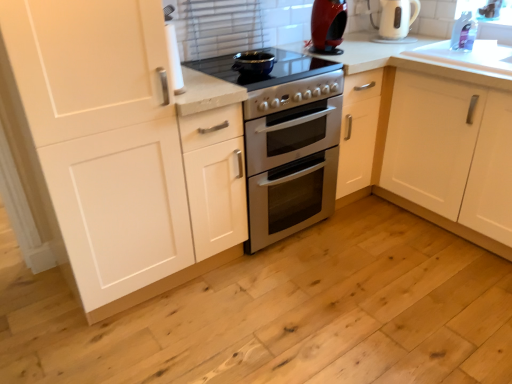
Locate an element on the screen. The width and height of the screenshot is (512, 384). vacant area that is situated to the right of white glossy oven at center, acting as the first appliance starting from the bottom is located at coordinates (374, 236).